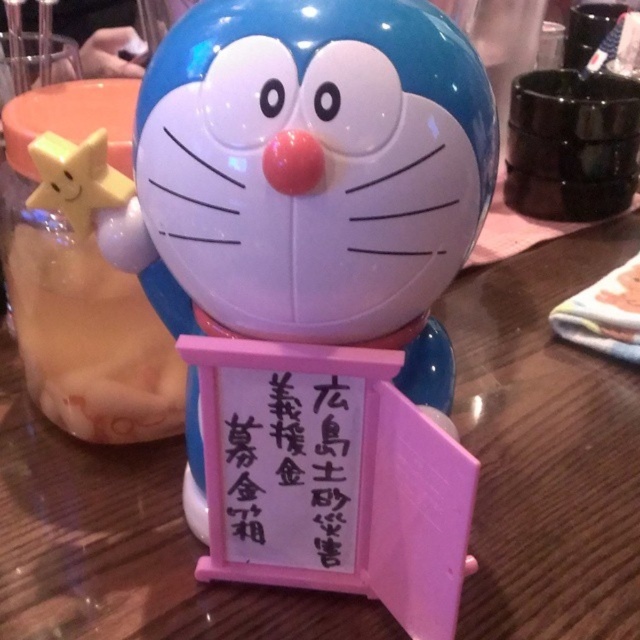
Question: Among these points, which one is nearest to the camera?

Choices:
 (A) (166, 60)
 (B) (344, 488)

Answer: (A)

Question: Can you confirm if glossy plastic doraemon at center is positioned above pink paper sign at center?

Choices:
 (A) no
 (B) yes

Answer: (B)

Question: Which of the following is the farthest from the observer?

Choices:
 (A) pink paper sign at center
 (B) glossy plastic doraemon at center

Answer: (A)

Question: Is glossy plastic doraemon at center positioned before pink paper sign at center?

Choices:
 (A) no
 (B) yes

Answer: (B)

Question: Where is glossy plastic doraemon at center located in relation to pink paper sign at center in the image?

Choices:
 (A) right
 (B) left

Answer: (A)